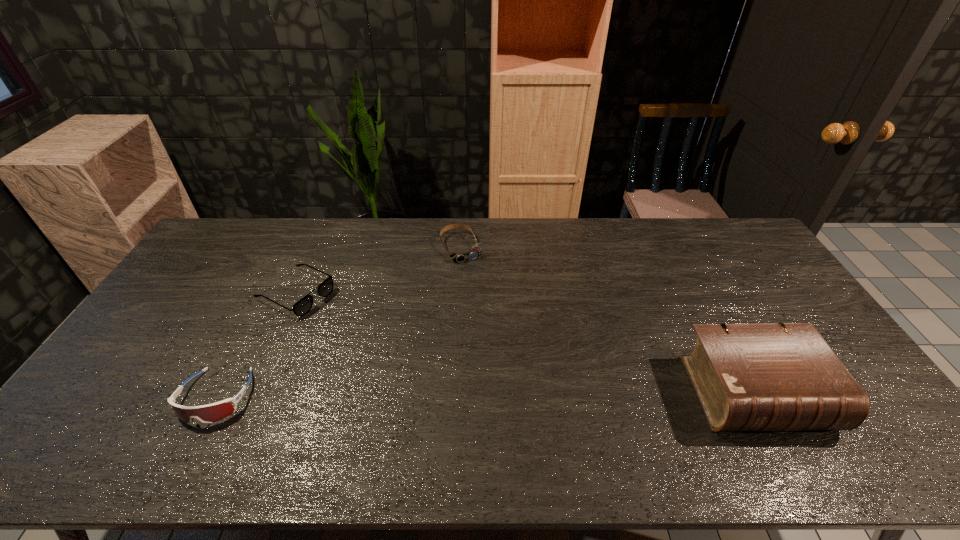
Locate an element on the screen. This screenshot has width=960, height=540. the taller goggles is located at coordinates (209, 413).

Where is `the nearer goggles`? The height and width of the screenshot is (540, 960). the nearer goggles is located at coordinates (209, 413).

Identify the location of Bible. (778, 376).

Where is `the rightmost object`? Image resolution: width=960 pixels, height=540 pixels. the rightmost object is located at coordinates point(778,376).

Where is `the shorter goggles`? the shorter goggles is located at coordinates (459, 257).

The height and width of the screenshot is (540, 960). I want to click on the farther goggles, so click(x=459, y=257).

Where is `the second farthest object`? The width and height of the screenshot is (960, 540). the second farthest object is located at coordinates (303, 306).

The height and width of the screenshot is (540, 960). Find the location of `vacant space located 0.190m on the front-facing side of the farther goggles`. vacant space located 0.190m on the front-facing side of the farther goggles is located at coordinates (488, 299).

You are a GUI agent. You are given a task and a screenshot of the screen. Output one action in this format:
    pyautogui.click(x=<x>, y=<y>)
    Task: Click on the vacant region located 0.320m on the front-facing side of the farther goggles
    
    Given the screenshot: What is the action you would take?
    pyautogui.click(x=503, y=328)

At what (x,y) coordinates should I click in order to perform the action: click on vacant space located 0.090m on the front-facing side of the farther goggles. Please return your answer as a coordinate pair (x, y). This screenshot has width=960, height=540. Looking at the image, I should click on (477, 279).